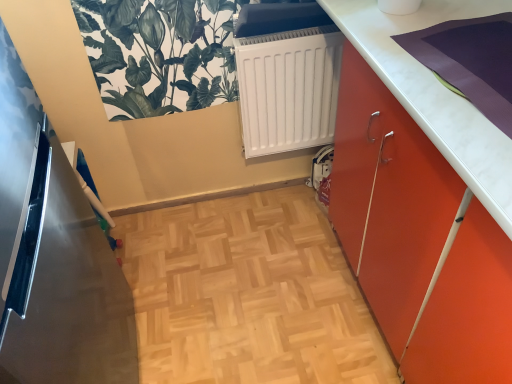
Describe the element at coordinates (53, 256) in the screenshot. I see `metallic refrigerator at left` at that location.

Measure the distance between point (17,163) and camera.

Point (17,163) is 1.37 meters from camera.

This screenshot has width=512, height=384. Describe the element at coordinates (159, 52) in the screenshot. I see `green leafy plant at upper left` at that location.

What is the approximate height of orange matte cabinet at right?

It is 34.21 inches.

At what (x,y) coordinates should I click in order to perform the action: click on white matte radiator at center. Please return your answer as a coordinate pair (x, y). This screenshot has height=384, width=512. Looking at the image, I should click on (288, 89).

From the image's perspective, between orange matte cabinet at right and metallic refrigerator at left, which one is located above?

orange matte cabinet at right, from the image's perspective.

Considering the relative sizes of orange matte cabinet at right and metallic refrigerator at left in the image provided, is orange matte cabinet at right shorter than metallic refrigerator at left?

Yes, orange matte cabinet at right is shorter than metallic refrigerator at left.

Is orange matte cabinet at right oriented towards metallic refrigerator at left?

Yes, orange matte cabinet at right is facing metallic refrigerator at left.

How far apart are metallic refrigerator at left and green leafy plant at upper left?

metallic refrigerator at left and green leafy plant at upper left are 48.36 centimeters apart from each other.

From the picture: What's the angular difference between metallic refrigerator at left and green leafy plant at upper left's facing directions?

The angular difference between metallic refrigerator at left and green leafy plant at upper left is 91.6 degrees.

From the image's perspective, which object appears higher, metallic refrigerator at left or green leafy plant at upper left?

green leafy plant at upper left, from the image's perspective.

Is point (102, 269) in front of point (192, 86)?

That is False.

Considering the relative sizes of metallic refrigerator at left and white matte radiator at center in the image provided, is metallic refrigerator at left wider than white matte radiator at center?

Indeed, metallic refrigerator at left has a greater width compared to white matte radiator at center.

Considering the points (98, 330) and (267, 41), which point is behind, point (98, 330) or point (267, 41)?

The point (98, 330) is farther from the camera.

In the scene shown: Does metallic refrigerator at left have a lesser height compared to white matte radiator at center?

No.

Which object is positioned more to the right, orange matte cabinet at right or green leafy plant at upper left?

orange matte cabinet at right.

Between orange matte cabinet at right and green leafy plant at upper left, which one has smaller size?

Smaller between the two is green leafy plant at upper left.

From the image's perspective, between orange matte cabinet at right and green leafy plant at upper left, which one is located above?

green leafy plant at upper left appears higher in the image.

Is orange matte cabinet at right wider or thinner than green leafy plant at upper left?

orange matte cabinet at right is wider than green leafy plant at upper left.

Is metallic refrigerator at left next to orange matte cabinet at right?

No.

Is metallic refrigerator at left further to camera compared to orange matte cabinet at right?

No, metallic refrigerator at left is closer to the viewer.

Considering the positions of objects metallic refrigerator at left and orange matte cabinet at right in the image provided, who is more to the left, metallic refrigerator at left or orange matte cabinet at right?

Positioned to the left is metallic refrigerator at left.

Considering the sizes of objects metallic refrigerator at left and orange matte cabinet at right in the image provided, who is thinner, metallic refrigerator at left or orange matte cabinet at right?

orange matte cabinet at right is thinner.

Considering the sizes of green leafy plant at upper left and metallic refrigerator at left in the image, is green leafy plant at upper left bigger or smaller than metallic refrigerator at left?

green leafy plant at upper left is smaller than metallic refrigerator at left.

From the image's perspective, between green leafy plant at upper left and metallic refrigerator at left, which one is located above?

green leafy plant at upper left.

Between green leafy plant at upper left and metallic refrigerator at left, which one has smaller width?

Thinner between the two is green leafy plant at upper left.

Considering the relative sizes of green leafy plant at upper left and orange matte cabinet at right in the image provided, is green leafy plant at upper left bigger than orange matte cabinet at right?

No.

Can we say green leafy plant at upper left lies outside orange matte cabinet at right?

That's correct, green leafy plant at upper left is outside of orange matte cabinet at right.

Measure the distance from green leafy plant at upper left to orange matte cabinet at right.

A distance of 27.87 inches exists between green leafy plant at upper left and orange matte cabinet at right.

Does point (165, 102) come behind point (408, 122)?

Yes.

This screenshot has height=384, width=512. In order to click on appliance that appears below the orange matte cabinet at right (from the image's perspective) in this screenshot , I will do `click(53, 256)`.

Find the location of a particular element. plant above the metallic refrigerator at left (from the image's perspective) is located at coordinates (159, 52).

When comparing their distances from orange matte cabinet at right, does green leafy plant at upper left or metallic refrigerator at left seem closer?

The object closer to orange matte cabinet at right is green leafy plant at upper left.

From the image, which object appears to be nearer to orange matte cabinet at right, metallic refrigerator at left or green leafy plant at upper left?

green leafy plant at upper left lies closer to orange matte cabinet at right than the other object.

When comparing their distances from orange matte cabinet at right, does metallic refrigerator at left or white matte radiator at center seem further?

Among the two, metallic refrigerator at left is located further to orange matte cabinet at right.

Based on their spatial positions, is metallic refrigerator at left or green leafy plant at upper left closer to white matte radiator at center?

Among the two, green leafy plant at upper left is located nearer to white matte radiator at center.

From the image, which object appears to be farther from green leafy plant at upper left, orange matte cabinet at right or white matte radiator at center?

orange matte cabinet at right.

Based on the photo, which object lies further to the anchor point white matte radiator at center, orange matte cabinet at right or green leafy plant at upper left?

orange matte cabinet at right lies further to white matte radiator at center than the other object.

From the image, which object appears to be nearer to metallic refrigerator at left, green leafy plant at upper left or white matte radiator at center?

The object closer to metallic refrigerator at left is green leafy plant at upper left.

From the image, which object appears to be farther from metallic refrigerator at left, orange matte cabinet at right or white matte radiator at center?

The object further to metallic refrigerator at left is orange matte cabinet at right.

The width and height of the screenshot is (512, 384). Find the location of `radiator between metallic refrigerator at left and orange matte cabinet at right from left to right`. radiator between metallic refrigerator at left and orange matte cabinet at right from left to right is located at coordinates (288, 89).

Locate an element on the screen. plant situated between metallic refrigerator at left and orange matte cabinet at right from left to right is located at coordinates (159, 52).

Locate an element on the screen. Image resolution: width=512 pixels, height=384 pixels. plant between orange matte cabinet at right and white matte radiator at center from front to back is located at coordinates (159, 52).

In order to click on plant located between metallic refrigerator at left and white matte radiator at center in the depth direction in this screenshot , I will do point(159,52).